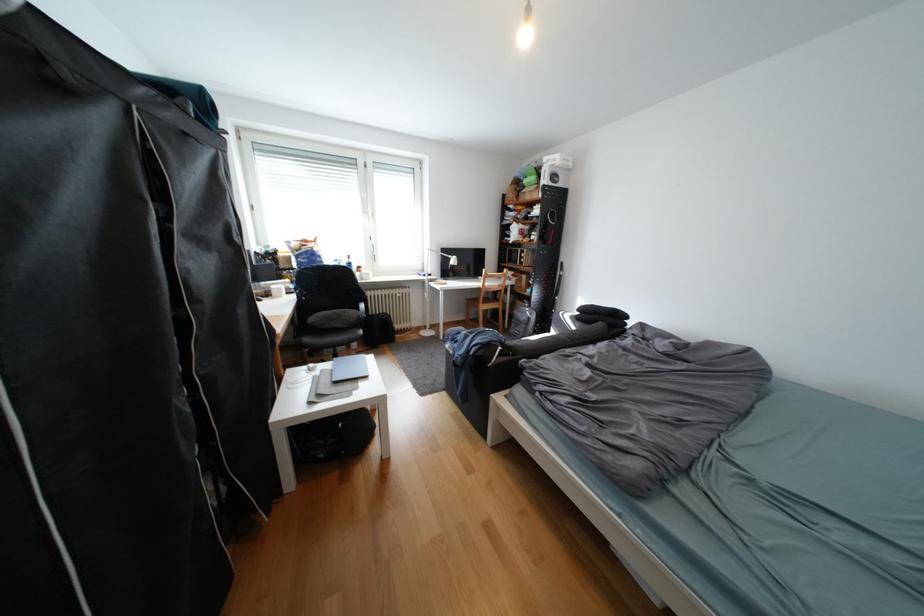
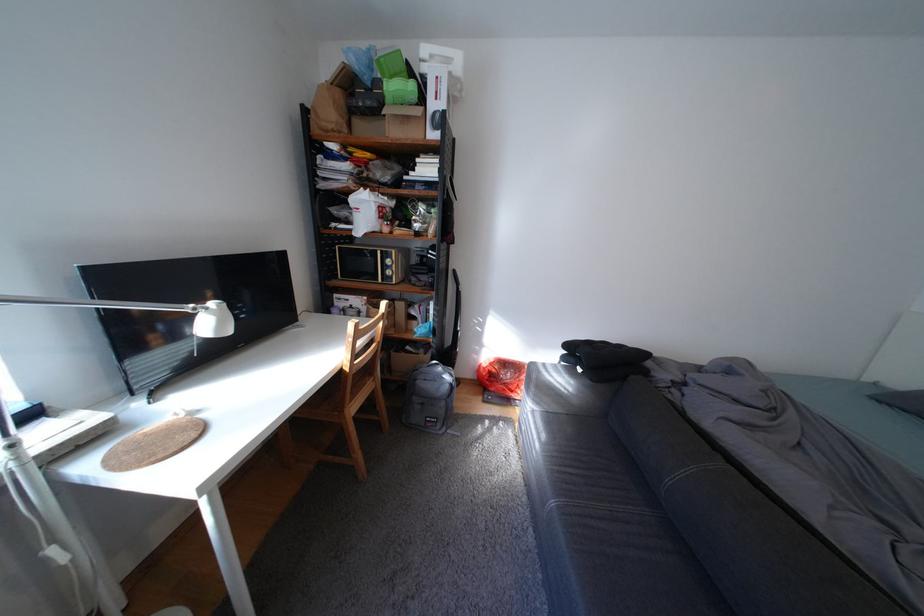
In the second image, find the point that corresponds to pixel 526 188 in the first image.

(351, 95)